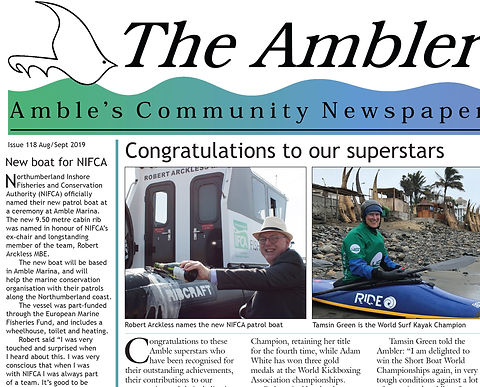
This screenshot has height=387, width=480. Find the location of `alcohol bottle`. alcohol bottle is located at coordinates (178, 270).